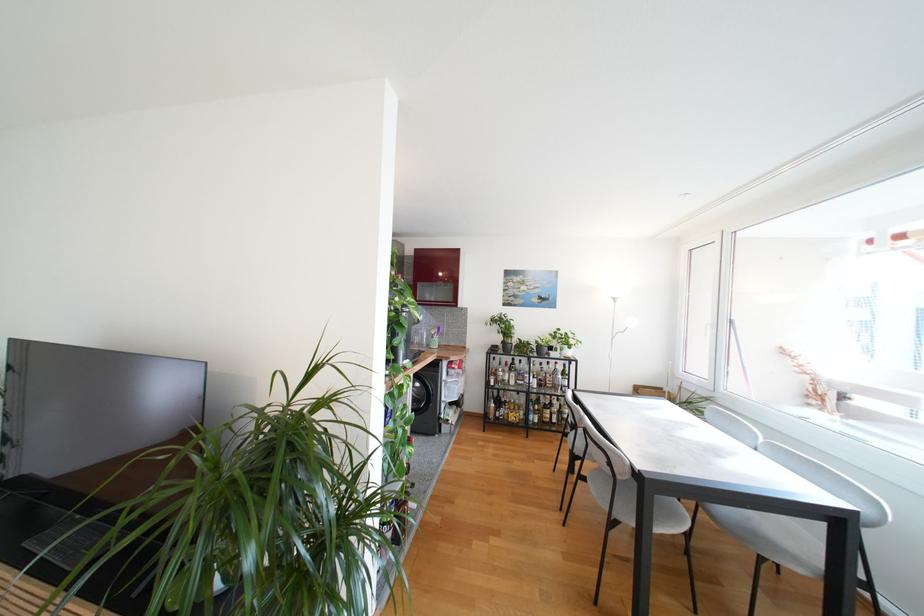
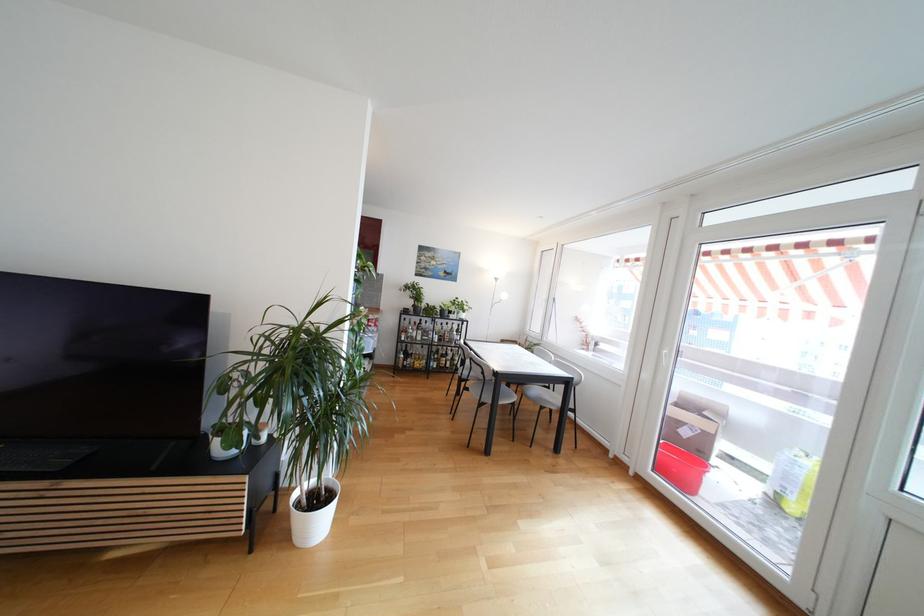
The point at (513,383) is marked in the first image. Where is the corresponding point in the second image?

(419, 339)